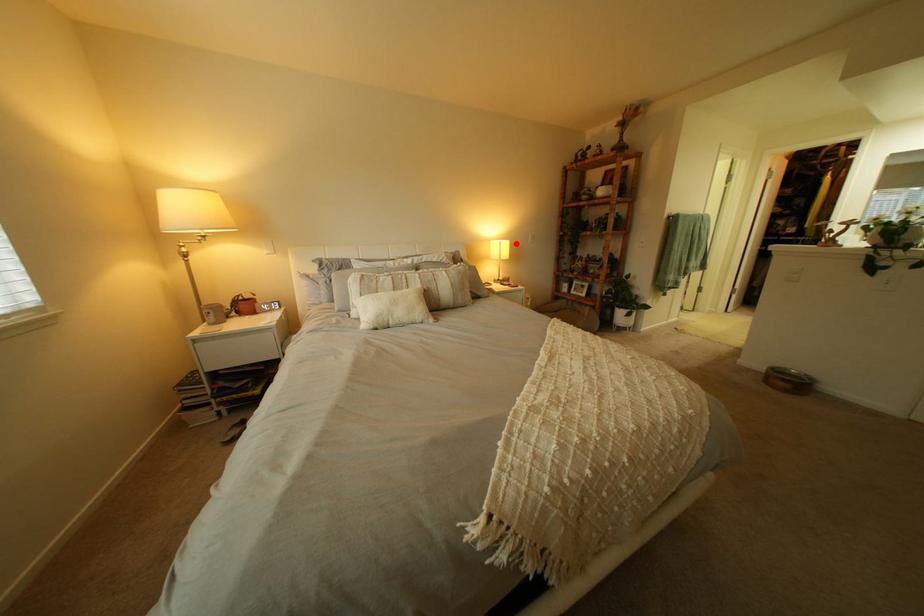
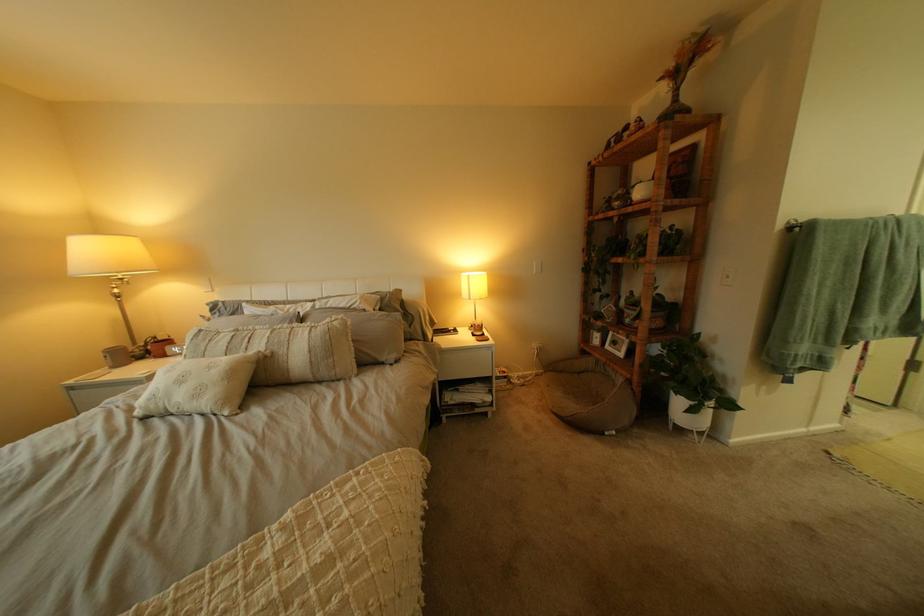
Question: I am providing you with two images of the same scene from different viewpoints. A red point is shown in image1. For the corresponding object point in image2, is it positioned nearer or farther from the camera?

Choices:
 (A) Nearer
 (B) Farther

Answer: (B)